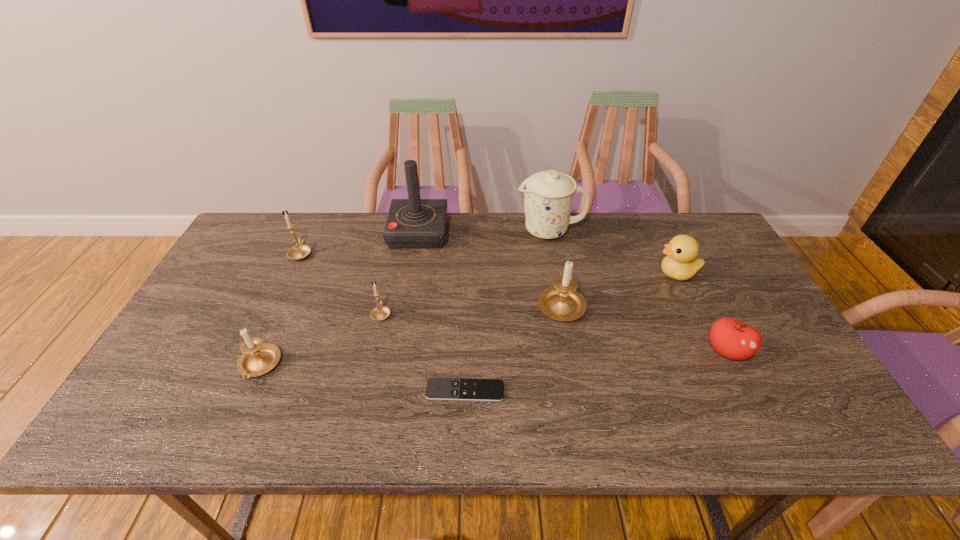
Locate an element on the screen. The image size is (960, 540). vacant area situated 0.140m on the handle side of the farther gold candle holder is located at coordinates (317, 219).

Locate an element on the screen. The height and width of the screenshot is (540, 960). blank area located 0.280m with a handle on the side of the farther beige candle holder is located at coordinates (546, 227).

The height and width of the screenshot is (540, 960). In order to click on free location located with a handle on the side of the farther beige candle holder in this screenshot , I will do `click(554, 268)`.

Identify the location of vacant point located 0.280m with a handle on the side of the farther beige candle holder. (546, 227).

This screenshot has height=540, width=960. I want to click on free spot located on the face of the yellow duck, so click(x=601, y=273).

The width and height of the screenshot is (960, 540). I want to click on free space located 0.190m on the face of the yellow duck, so click(x=591, y=273).

Where is `vacant space located 0.380m on the face of the yellow duck`? Image resolution: width=960 pixels, height=540 pixels. vacant space located 0.380m on the face of the yellow duck is located at coordinates (528, 273).

Identify the location of vacant space located 0.100m on the handle side of the nearer gold candle holder. (389, 280).

Identify the location of vacant position located on the handle side of the nearer gold candle holder. (396, 244).

The width and height of the screenshot is (960, 540). In order to click on vacant space located 0.260m on the handle side of the nearer gold candle holder in this screenshot , I will do `click(396, 246)`.